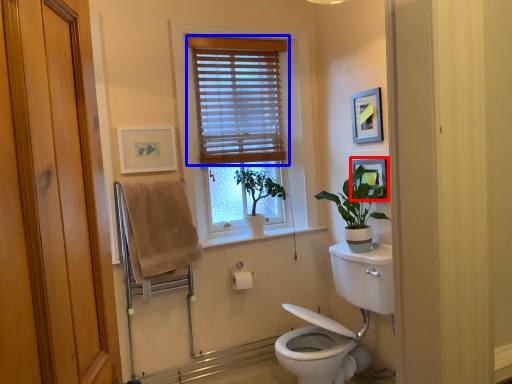
Question: Which object is further to the camera taking this photo, picture frame (highlighted by a red box) or window blind (highlighted by a blue box)?

Choices:
 (A) picture frame
 (B) window blind

Answer: (B)